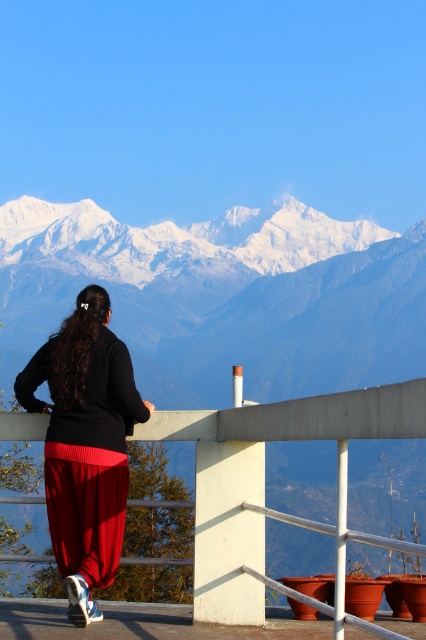
You are a photographer planning to capture the scene of the person at the viewpoint. You have a camera with a 100mm lens that has a narrow field of view. To ensure both the concrete at center and the matte black sweater at center are fully visible in the frame, what adjustment should you make?

The concrete at center is bigger than the matte black sweater at center. To include both in the frame, you should use a wider lens or move closer to the subject so that the larger concrete area and the smaller sweater can fit within the camera view.

Looking at this image, you are a photographer wanting to capture the person in the matte black sweater at center and the concrete at center in the same frame. Which object is closer to the camera?

The concrete at center is shorter than the matte black sweater at center, so the concrete at center is closer to the camera.

You are a photographer trying to capture the person in the matte black sweater at center from above the concrete at center. Is this possible given their positions?

The concrete at center is located above the matte black sweater at center, so yes, you can position yourself above the concrete at center to capture the person in the matte black sweater at center from above.